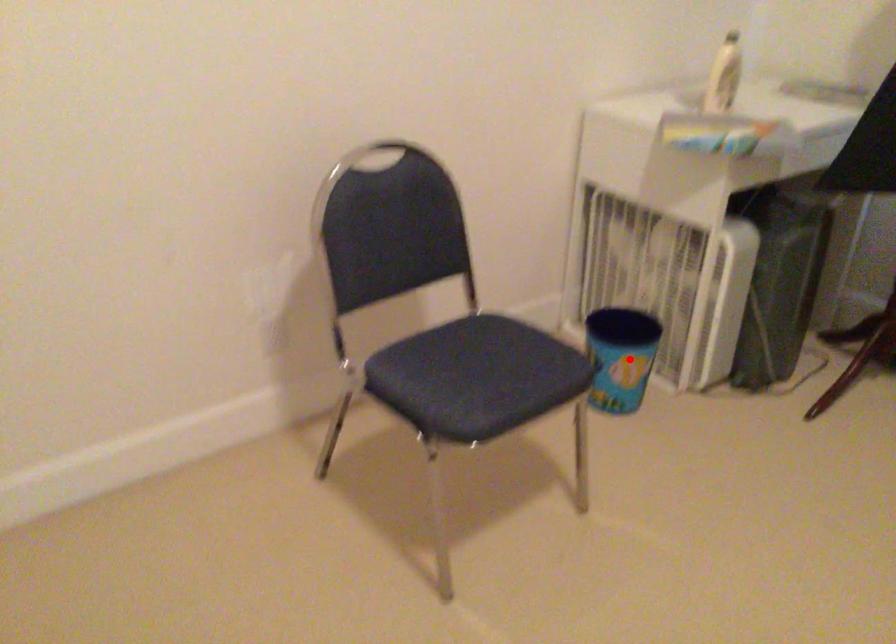
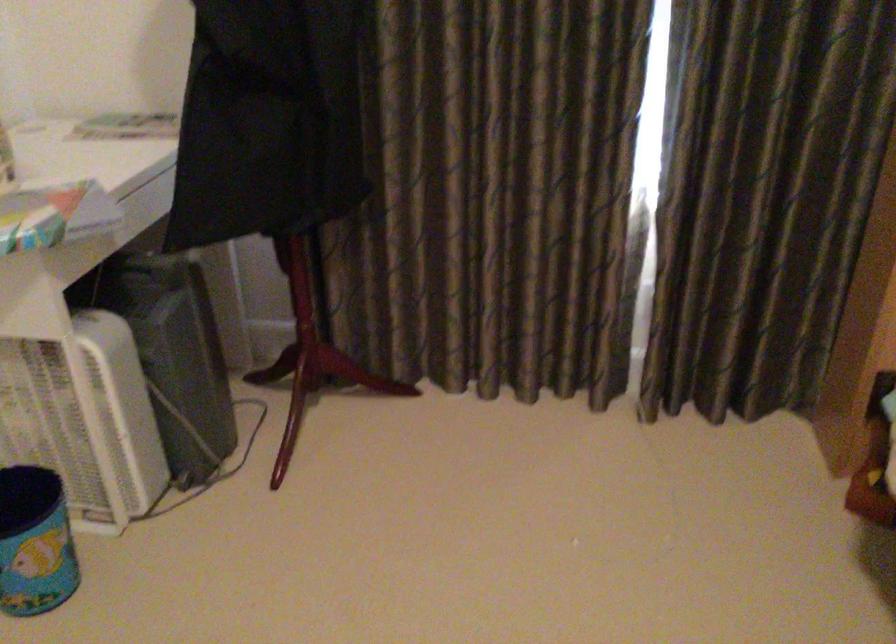
The point at the highlighted location is marked in the first image. Where is the corresponding point in the second image?

(35, 542)